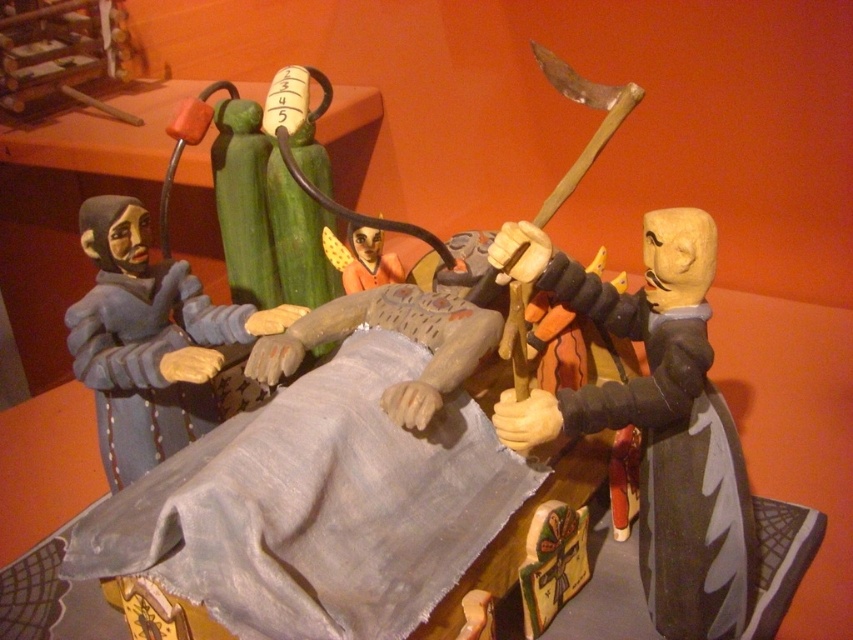
Between wooden figure at right and orange fabric doll at center, which one is positioned higher?

orange fabric doll at center is above.

Which is behind, point (502, 406) or point (329, 252)?

The point (329, 252) is more distant.

Identify the location of wooden figure at right. The width and height of the screenshot is (853, 640). (654, 417).

Is smooth gray fabric at center bigger than matte gray figure at left?

Correct, smooth gray fabric at center is larger in size than matte gray figure at left.

Can you confirm if smooth gray fabric at center is wider than matte gray figure at left?

Indeed, smooth gray fabric at center has a greater width compared to matte gray figure at left.

Which is behind, point (277, 520) or point (200, 285)?

The point (200, 285) is more distant.

This screenshot has height=640, width=853. What are the coordinates of `smooth gray fabric at center` in the screenshot? It's located at (328, 483).

Can you confirm if smooth gray fabric at center is positioned above orange fabric doll at center?

Actually, smooth gray fabric at center is below orange fabric doll at center.

Does smooth gray fabric at center appear on the left side of orange fabric doll at center?

In fact, smooth gray fabric at center is to the right of orange fabric doll at center.

Does point (376, 376) lie in front of point (335, 253)?

That is True.

The width and height of the screenshot is (853, 640). What are the coordinates of `smooth gray fabric at center` in the screenshot? It's located at (328, 483).